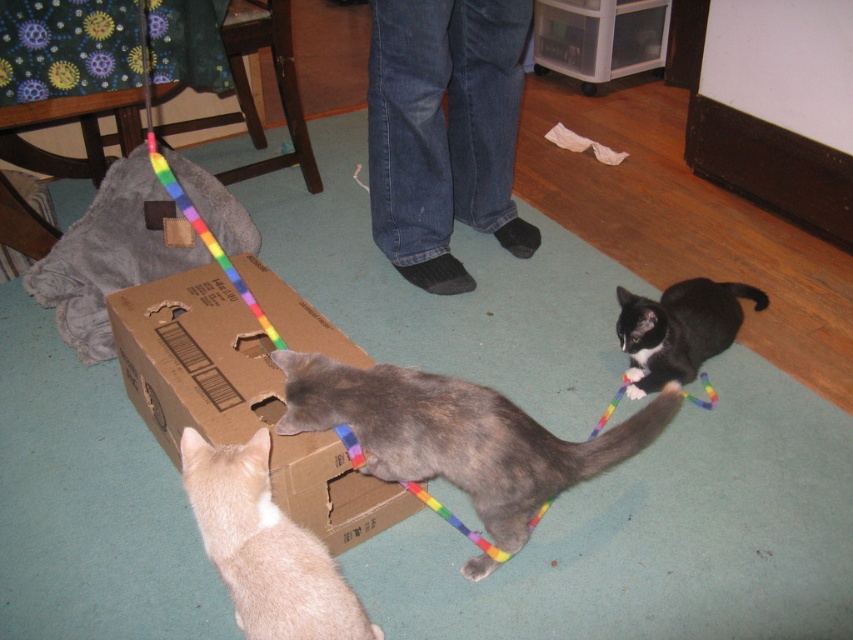
You are a cat owner who wants to place a 3.5 feet long cat tunnel in the room. The tunnel needs to be placed 3 feet away from the brown cardboard box at center. Is there enough space to do so without overlapping the box?

The brown cardboard box at center is 4.14 feet from the camera. Since the tunnel needs to be placed 3 feet away from the box, the total distance from the camera would be 4.14 feet minus 3 feet, which equals 1.14 feet. This means there is sufficient space between the camera and the box to place the tunnel without overlapping the box.

You are a small toy mouse that wants to hide inside the brown cardboard box at center. However, you need to avoid the black glossy cat at lower right. Is the box tall enough to hide you from the cat?

The brown cardboard box at center is much taller than the black glossy cat at lower right, so the box is tall enough to hide you from the cat.